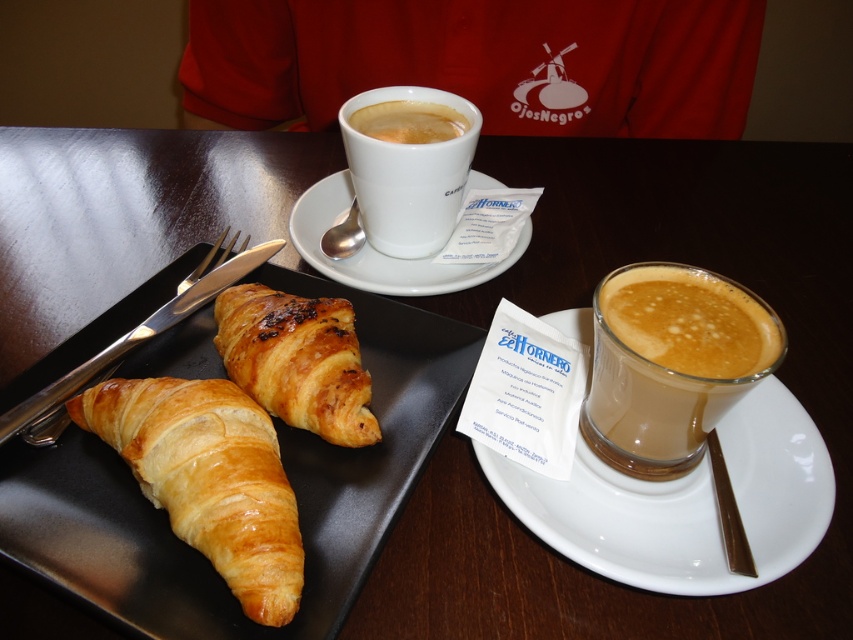
You are a waiter who needs to place a new dessert plate on the table without moving any existing items. The dessert plate has a diameter of 20 cm. There is a point at coordinates (672, 369) on the table. Can you place the dessert plate here?

The point at (672, 369) has a translucent glass cup at center, so placing the dessert plate there would displace the cup. Choose another spot.

You are a barista observing the breakfast table. You need to place a new coffee cup between the golden brown flaky croissant at lower left and the cappuccino foam at upper center. Based on their positions, where should you place the cup so it is equidistant from both?

The golden brown flaky croissant at lower left is below the cappuccino foam at upper center. To place the coffee cup equidistant from both, position it halfway between them along the vertical axis.

You are setting up a small tray for a guest and need to place both the translucent glass cup at center and the silvermetallicknife at left on it. The tray is only 10 inches wide. Can both items fit side by side on the tray without overlapping?

The translucent glass cup at center and silvermetallicknife at left are 10.81 inches apart, so they cannot fit side by side on a 10 inch wide tray without overlapping.